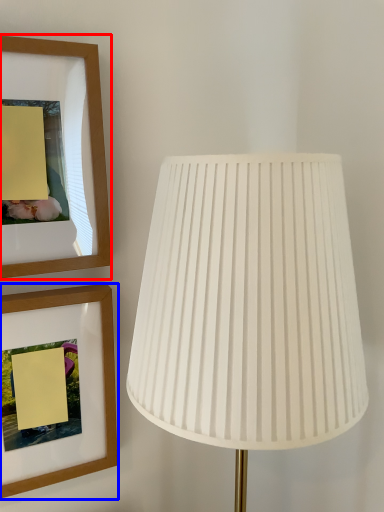
Question: Which object appears closest to the camera in this image, picture frame (highlighted by a red box) or picture frame (highlighted by a blue box)?

Choices:
 (A) picture frame
 (B) picture frame

Answer: (A)